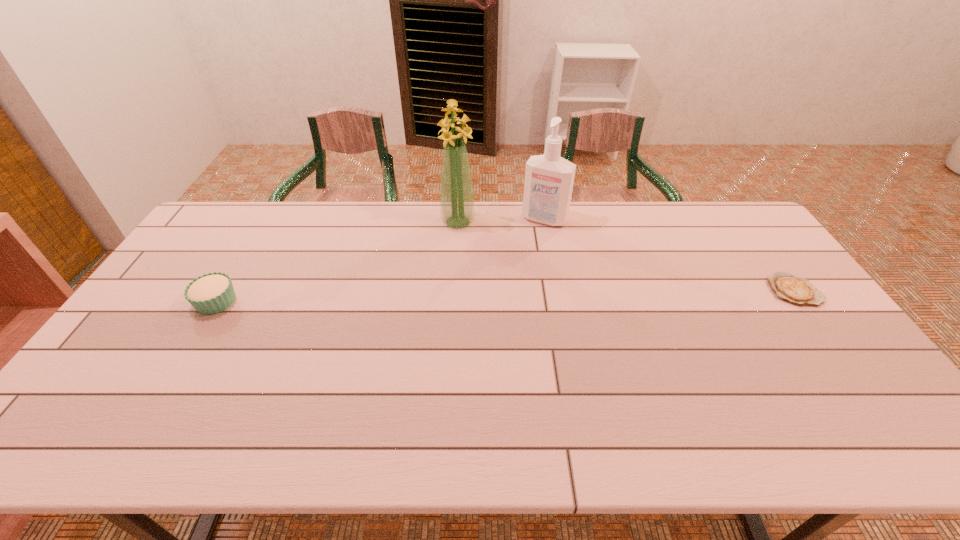
The width and height of the screenshot is (960, 540). I want to click on unoccupied area between the second object from left to right and the leftmost object, so click(x=337, y=262).

At what (x,y) coordinates should I click in order to perform the action: click on vacant point located between the second tallest object and the rightmost object. Please return your answer as a coordinate pair (x, y). This screenshot has width=960, height=540. Looking at the image, I should click on (669, 255).

This screenshot has height=540, width=960. Identify the location of free spot between the cupcake and the bouquet. (337, 262).

Where is `free spot between the shortest object and the cleansing agent`? free spot between the shortest object and the cleansing agent is located at coordinates pos(669,255).

This screenshot has height=540, width=960. Find the location of `empty space between the cleansing agent and the leftmost object`. empty space between the cleansing agent and the leftmost object is located at coordinates (380, 260).

Choose which object is the second nearest neighbor to the rightmost object. Please provide its 2D coordinates. Your answer should be formatted as a tuple, i.e. [(x, y)], where the tuple contains the x and y coordinates of a point satisfying the conditions above.

[(457, 203)]

The image size is (960, 540). Find the location of `object that ranks as the third closest to the third object from left to right`. object that ranks as the third closest to the third object from left to right is located at coordinates (211, 293).

Image resolution: width=960 pixels, height=540 pixels. In order to click on free space that satisfies the following two spatial constraints: 1. on the back side of the quiche; 2. on the right side of the leftmost object in this screenshot , I will do `click(224, 290)`.

Where is `vacant region that satisfies the following two spatial constraints: 1. on the front side of the shortest object; 2. on the right side of the third shortest object`? This screenshot has height=540, width=960. vacant region that satisfies the following two spatial constraints: 1. on the front side of the shortest object; 2. on the right side of the third shortest object is located at coordinates (558, 290).